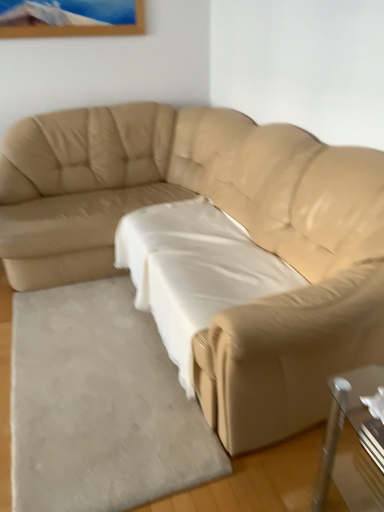
Question: Is white fabric sheet at center positioned behind beige leather couch at center?

Choices:
 (A) no
 (B) yes

Answer: (B)

Question: From a real-world perspective, is white fabric sheet at center under beige leather couch at center?

Choices:
 (A) no
 (B) yes

Answer: (B)

Question: Is beige leather couch at center completely or partially inside white fabric sheet at center?

Choices:
 (A) yes
 (B) no

Answer: (B)

Question: Does white fabric sheet at center lie in front of beige leather couch at center?

Choices:
 (A) no
 (B) yes

Answer: (A)

Question: Is white fabric sheet at center turned away from beige leather couch at center?

Choices:
 (A) yes
 (B) no

Answer: (A)

Question: Does white fabric sheet at center have a larger size compared to beige leather couch at center?

Choices:
 (A) yes
 (B) no

Answer: (B)

Question: From a real-world perspective, is beige leather couch at center located beneath white soft rug at lower left?

Choices:
 (A) no
 (B) yes

Answer: (A)

Question: Is beige leather couch at center looking in the opposite direction of white soft rug at lower left?

Choices:
 (A) yes
 (B) no

Answer: (B)

Question: Can you confirm if beige leather couch at center is taller than white soft rug at lower left?

Choices:
 (A) yes
 (B) no

Answer: (A)

Question: Is beige leather couch at center at the right side of white soft rug at lower left?

Choices:
 (A) yes
 (B) no

Answer: (A)

Question: Considering the relative positions of beige leather couch at center and white soft rug at lower left in the image provided, is beige leather couch at center to the left of white soft rug at lower left from the viewer's perspective?

Choices:
 (A) no
 (B) yes

Answer: (A)

Question: From the image's perspective, would you say beige leather couch at center is shown under white soft rug at lower left?

Choices:
 (A) no
 (B) yes

Answer: (A)

Question: Considering the relative sizes of white soft rug at lower left and beige leather couch at center in the image provided, is white soft rug at lower left bigger than beige leather couch at center?

Choices:
 (A) yes
 (B) no

Answer: (B)